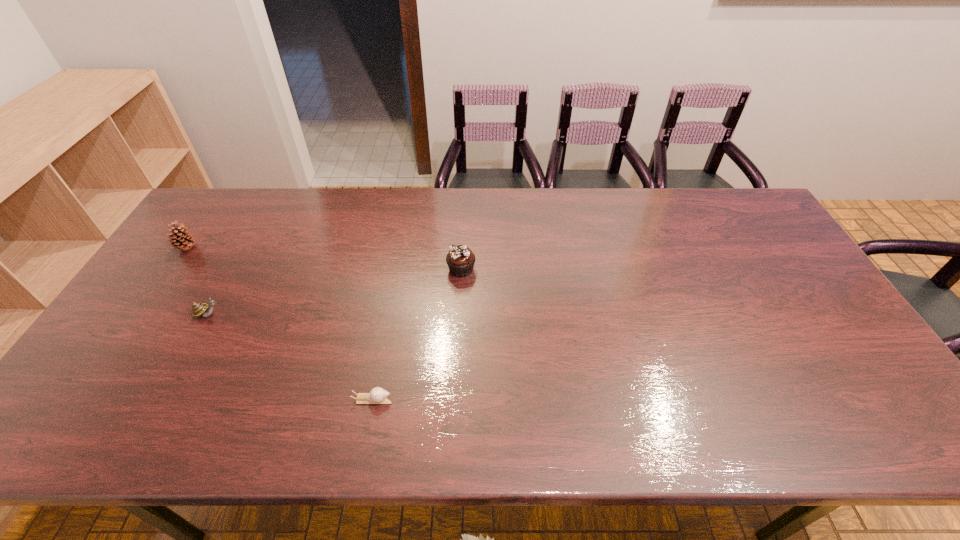
At what (x,y) coordinates should I click in order to perform the action: click on free space between the left escargot and the cupcake. Please return your answer as a coordinate pair (x, y). The width and height of the screenshot is (960, 540). Looking at the image, I should click on click(x=335, y=292).

Find the location of a particular element. Image resolution: width=960 pixels, height=540 pixels. vacant space that is in between the right escargot and the second farthest object is located at coordinates (417, 334).

Find the location of a particular element. Image resolution: width=960 pixels, height=540 pixels. free space between the second nearest object and the farthest object is located at coordinates (198, 281).

Where is `blank region between the shortest object and the second object from left to right`? blank region between the shortest object and the second object from left to right is located at coordinates (291, 357).

At what (x,y) coordinates should I click in order to perform the action: click on vacant region between the rightmost object and the farthest object. Please return your answer as a coordinate pair (x, y). Looking at the image, I should click on (324, 259).

Locate an element on the screen. vacant area between the cupcake and the shorter escargot is located at coordinates (417, 334).

Where is `free space between the cupcake and the farther escargot`? The height and width of the screenshot is (540, 960). free space between the cupcake and the farther escargot is located at coordinates (335, 292).

I want to click on free area in between the second object from right to left and the cupcake, so click(x=417, y=334).

Where is `empty space between the left escargot and the farthest object`? This screenshot has height=540, width=960. empty space between the left escargot and the farthest object is located at coordinates (198, 281).

What are the coordinates of `unoccupied position between the leftmost object and the second object from left to right` in the screenshot? It's located at (198, 281).